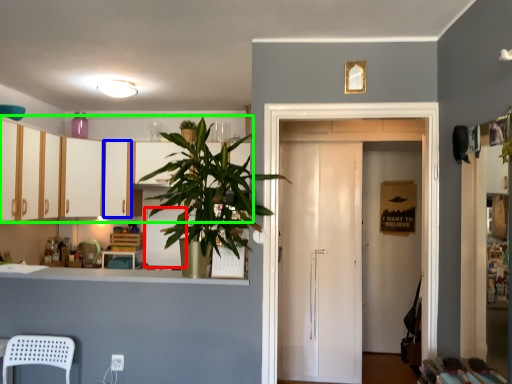
Question: Which is farther away from appliance (highlighted by a red box)? cabinetry (highlighted by a blue box) or cabinetry (highlighted by a green box)?

Choices:
 (A) cabinetry
 (B) cabinetry

Answer: (B)